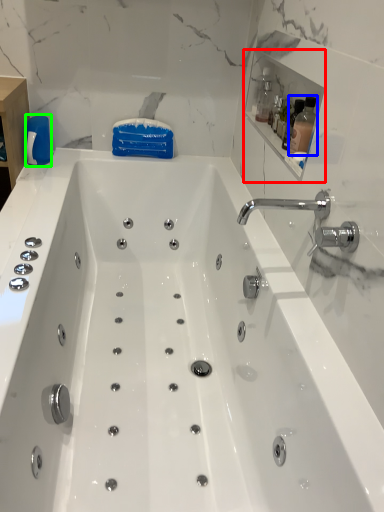
Question: Considering the real-world distances, which object is farthest from medicine cabinet (highlighted by a red box)? bottle (highlighted by a blue box) or cleaning product (highlighted by a green box)?

Choices:
 (A) bottle
 (B) cleaning product

Answer: (B)